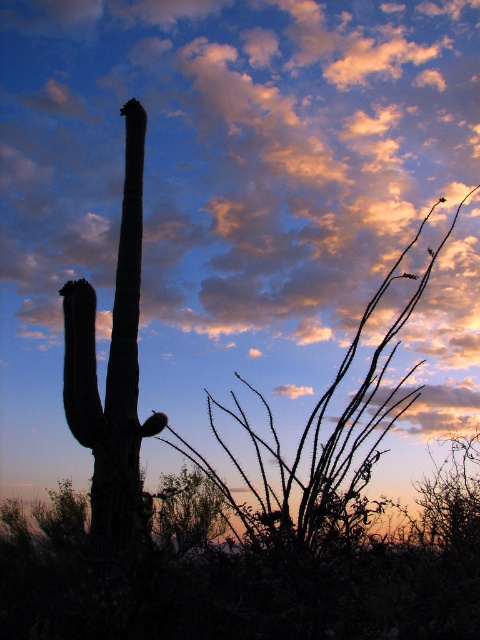
Question: Does orange cotton cloud at upper center appear over silhouette cactus at left?

Choices:
 (A) no
 (B) yes

Answer: (B)

Question: Is orange cotton cloud at upper center below silhouette cactus at left?

Choices:
 (A) no
 (B) yes

Answer: (A)

Question: Which object appears closest to the camera in this image?

Choices:
 (A) silhouette cactus at left
 (B) orange cotton cloud at upper center

Answer: (A)

Question: Is orange cotton cloud at upper center positioned in front of silhouette cactus at left?

Choices:
 (A) no
 (B) yes

Answer: (A)

Question: Among these objects, which one is farthest from the camera?

Choices:
 (A) silhouette cactus at left
 (B) orange cotton cloud at upper center

Answer: (B)

Question: Among these points, which one is farthest from the camera?

Choices:
 (A) (419, 573)
 (B) (40, 198)

Answer: (B)